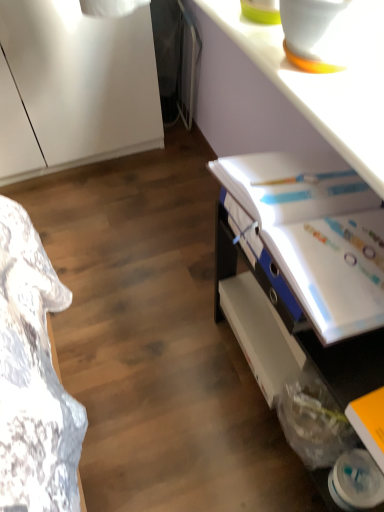
What do you see at coordinates (369, 422) in the screenshot? I see `yellow matte book at lower right, which appears as the 1th book when viewed from the front` at bounding box center [369, 422].

The height and width of the screenshot is (512, 384). I want to click on white plastic shelf at lower right, so click(260, 334).

Where is `yellow matte book at lower right, the first book from the bottom`? The width and height of the screenshot is (384, 512). yellow matte book at lower right, the first book from the bottom is located at coordinates (369, 422).

The height and width of the screenshot is (512, 384). Find the location of `shelf behind the white glossy desk at lower right`. shelf behind the white glossy desk at lower right is located at coordinates (260, 334).

Which object is thinner, white glossy desk at lower right or white plastic shelf at lower right?

white plastic shelf at lower right is thinner.

Which object is positioned more to the right, white glossy desk at lower right or white plastic shelf at lower right?

white glossy desk at lower right.

Is point (267, 386) less distant than point (246, 179)?

No, (267, 386) is behind (246, 179).

From a real-world perspective, between white plastic shelf at lower right and white glossy binder at upper right, marked as the second book in a bottom-to-top arrangement, who is vertically lower?

In real-world perspective, white plastic shelf at lower right is lower.

In the image, there is a white glossy binder at upper right, which is counted as the 2th book, starting from the front. Where is `shelf below it (from the image's perspective)`? shelf below it (from the image's perspective) is located at coordinates (260, 334).

Is white plastic shelf at lower right in front of white glossy binder at upper right, arranged as the first book when viewed from the back?

No, white plastic shelf at lower right is behind white glossy binder at upper right, arranged as the first book when viewed from the back.

From a real-world perspective, between yellow matte book at lower right, placed as the second book when sorted from top to bottom, and white glossy desk at lower right, who is vertically lower?

From a 3D spatial view, white glossy desk at lower right is below.

Considering the positions of point (373, 439) and point (246, 284), is point (373, 439) closer or farther from the camera than point (246, 284)?

Clearly, point (373, 439) is closer to the camera than point (246, 284).

Is yellow matte book at lower right, placed as the second book when sorted from back to front, oriented away from white glossy desk at lower right?

Yes, yellow matte book at lower right, placed as the second book when sorted from back to front,'s orientation is away from white glossy desk at lower right.

Which is correct: yellow matte book at lower right, placed as the second book when sorted from back to front, is inside white glossy desk at lower right, or outside of it?

The correct answer is: inside.

Considering the relative positions of white glossy counter top at upper right and yellow matte book at lower right, placed as the second book when sorted from back to front, in the image provided, is white glossy counter top at upper right behind yellow matte book at lower right, placed as the second book when sorted from back to front,?

No, the depth of white glossy counter top at upper right is less than that of yellow matte book at lower right, placed as the second book when sorted from back to front.

How distant is white glossy counter top at upper right from yellow matte book at lower right, placed as the second book when sorted from top to bottom?

white glossy counter top at upper right is 87.82 centimeters from yellow matte book at lower right, placed as the second book when sorted from top to bottom.

Locate an element on the screen. counter top above the yellow matte book at lower right, which appears as the 1th book when viewed from the front (from the image's perspective) is located at coordinates (300, 88).

Based on the photo, from a real-world perspective, is white glossy counter top at upper right positioned under yellow matte book at lower right, placed as the second book when sorted from back to front, based on gravity?

No, from a real-world perspective, white glossy counter top at upper right is not below yellow matte book at lower right, placed as the second book when sorted from back to front.

Between yellow matte book at lower right, the first book from the bottom, and white plastic shelf at lower right, which one is positioned in front?

yellow matte book at lower right, the first book from the bottom, is more forward.

From a real-world perspective, is yellow matte book at lower right, which appears as the 1th book when viewed from the front, on white plastic shelf at lower right?

Yes.

Where is `book that is the 1st object above the white plastic shelf at lower right (from a real-world perspective)`? book that is the 1st object above the white plastic shelf at lower right (from a real-world perspective) is located at coordinates (369, 422).

Considering the sizes of objects white glossy desk at lower right and white glossy counter top at upper right in the image provided, who is taller, white glossy desk at lower right or white glossy counter top at upper right?

white glossy desk at lower right.

At what (x,y) coordinates should I click in order to perform the action: click on desk located underneath the white glossy counter top at upper right (from a real-world perspective). Please return your answer as a coordinate pair (x, y). This screenshot has width=384, height=512. Looking at the image, I should click on (309, 254).

From the image's perspective, between white glossy desk at lower right and white glossy counter top at upper right, which one is located above?

white glossy counter top at upper right appears higher in the image.

Considering the sizes of objects white glossy desk at lower right and white glossy counter top at upper right in the image provided, who is smaller, white glossy desk at lower right or white glossy counter top at upper right?

white glossy counter top at upper right is smaller.

From the image's perspective, is white glossy binder at upper right, the first book in the top-to-bottom sequence, located above white plastic shelf at lower right?

Yes, from the image's perspective, white glossy binder at upper right, the first book in the top-to-bottom sequence, is on top of white plastic shelf at lower right.

Measure the distance from white glossy binder at upper right, arranged as the first book when viewed from the back, to white plastic shelf at lower right.

white glossy binder at upper right, arranged as the first book when viewed from the back, and white plastic shelf at lower right are 13.71 inches apart from each other.

The width and height of the screenshot is (384, 512). There is a white plastic shelf at lower right. In order to click on the 2nd book above it (from a real-world perspective) in this screenshot , I will do `click(316, 234)`.

Looking at this image, can you tell me how much white glossy binder at upper right, the first book in the top-to-bottom sequence, and white plastic shelf at lower right differ in facing direction?

0.00105 degrees separate the facing orientations of white glossy binder at upper right, the first book in the top-to-bottom sequence, and white plastic shelf at lower right.

Where is `shelf that appears behind the white glossy desk at lower right`? Image resolution: width=384 pixels, height=512 pixels. shelf that appears behind the white glossy desk at lower right is located at coordinates (260, 334).

Find the location of a particular element. book above the white plastic shelf at lower right (from the image's perspective) is located at coordinates (316, 234).

Estimate the real-world distances between objects in this image. Which object is further from yellow matte book at lower right, the first book from the bottom, white plastic shelf at lower right or white glossy desk at lower right?

white plastic shelf at lower right lies further to yellow matte book at lower right, the first book from the bottom, than the other object.

Based on their spatial positions, is white glossy desk at lower right or white plastic shelf at lower right further from white glossy counter top at upper right?

white plastic shelf at lower right.

Which object lies nearer to the anchor point white glossy counter top at upper right, yellow matte book at lower right, which appears as the 1th book when viewed from the front, or white plastic shelf at lower right?

Based on the image, white plastic shelf at lower right appears to be nearer to white glossy counter top at upper right.

Considering their positions, is yellow matte book at lower right, placed as the second book when sorted from back to front, positioned further to white glossy desk at lower right than white glossy counter top at upper right?

white glossy counter top at upper right.

Estimate the real-world distances between objects in this image. Which object is further from white glossy counter top at upper right, white plastic shelf at lower right or white glossy binder at upper right, the first book in the top-to-bottom sequence?

white plastic shelf at lower right.

Which object lies nearer to the anchor point yellow matte book at lower right, placed as the second book when sorted from top to bottom, white plastic shelf at lower right or white glossy counter top at upper right?

The object closer to yellow matte book at lower right, placed as the second book when sorted from top to bottom, is white plastic shelf at lower right.

When comparing their distances from yellow matte book at lower right, the first book from the bottom, does white glossy counter top at upper right or white glossy desk at lower right seem further?

white glossy counter top at upper right.

Which object lies nearer to the anchor point yellow matte book at lower right, the first book from the bottom, white plastic shelf at lower right or white glossy binder at upper right, marked as the second book in a bottom-to-top arrangement?

white glossy binder at upper right, marked as the second book in a bottom-to-top arrangement, is positioned closer to the anchor yellow matte book at lower right, the first book from the bottom.

Find the location of `shelf that lies between white glossy counter top at upper right and yellow matte book at lower right, placed as the second book when sorted from back to front, from top to bottom`. shelf that lies between white glossy counter top at upper right and yellow matte book at lower right, placed as the second book when sorted from back to front, from top to bottom is located at coordinates (260, 334).

Identify the location of book between white glossy counter top at upper right and white plastic shelf at lower right in the up-down direction. The height and width of the screenshot is (512, 384). (316, 234).

Locate an element on the screen. This screenshot has width=384, height=512. desk between white glossy binder at upper right, arranged as the first book when viewed from the back, and yellow matte book at lower right, placed as the second book when sorted from top to bottom, in the up-down direction is located at coordinates (309, 254).

Find the location of a particular element. The height and width of the screenshot is (512, 384). desk that lies between white glossy counter top at upper right and yellow matte book at lower right, placed as the second book when sorted from top to bottom, from top to bottom is located at coordinates (309, 254).